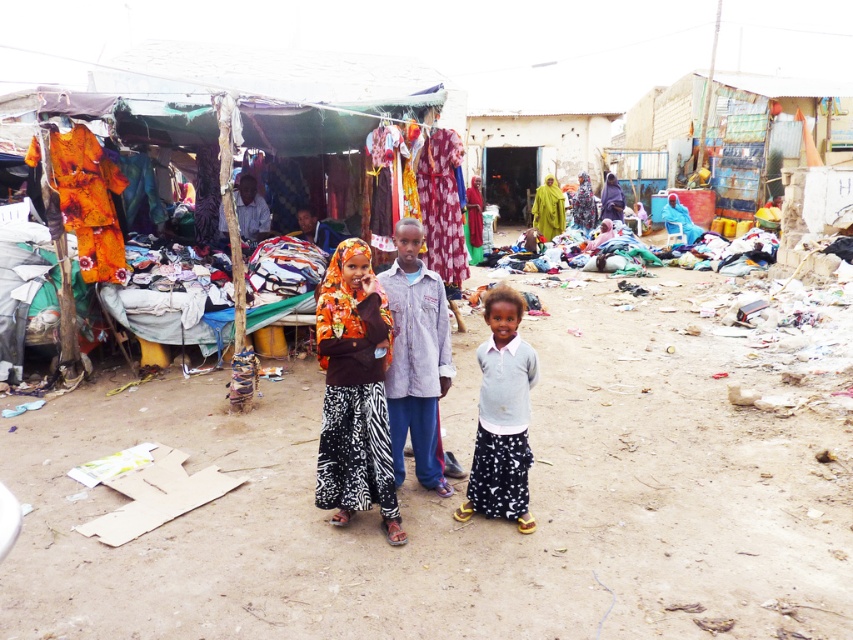
Can you confirm if printed fabric dress at center is positioned to the left of purple matte hijab at center?

Indeed, printed fabric dress at center is positioned on the left side of purple matte hijab at center.

Between printed fabric dress at center and purple matte hijab at center, which one has less height?

purple matte hijab at center

Measure the distance between printed fabric dress at center and camera.

printed fabric dress at center is 3.72 meters away from camera.

Where is `printed fabric dress at center`? This screenshot has height=640, width=853. printed fabric dress at center is located at coordinates (354, 392).

Who is positioned more to the right, white dotted skirt at lower right or purple matte hijab at center?

From the viewer's perspective, purple matte hijab at center appears more on the right side.

In the scene shown: Who is higher up, white dotted skirt at lower right or purple matte hijab at center?

purple matte hijab at center is above.

Where is `white dotted skirt at lower right`? The height and width of the screenshot is (640, 853). white dotted skirt at lower right is located at coordinates (502, 416).

How far apart are printed fabric dress at center and yellow-green fabric at center?

The distance of printed fabric dress at center from yellow-green fabric at center is 39.65 feet.

Which is behind, point (322, 285) or point (550, 236)?

Positioned behind is point (550, 236).

Which is behind, point (376, 369) or point (554, 196)?

The point (554, 196) is behind.

Locate an element on the screen. The height and width of the screenshot is (640, 853). printed fabric dress at center is located at coordinates (354, 392).